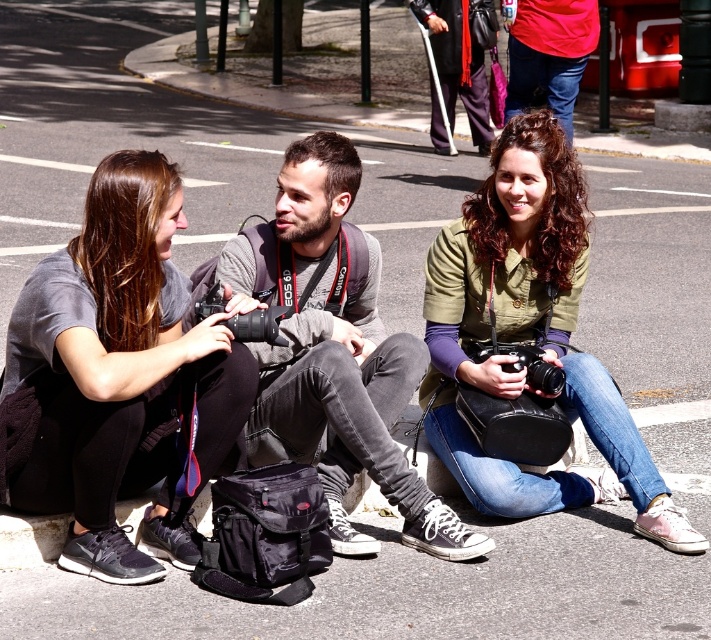
You are a photographer trying to decide which camera to use between the matte black camera at left and the green matte shirt at center. Based on their sizes, which one is narrower?

The matte black camera at left is narrower than the green matte shirt at center.

You are a photographer trying to capture a group shot of the two people wearing the green matte shirt at center and matte gray shirt at center. Which one should you focus on first if you want to start from the left side?

The matte gray shirt at center should be focused on first because it is positioned on the left side of the green matte shirt at center.